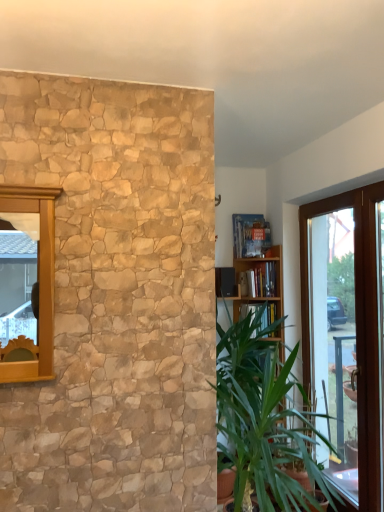
Question: Is point (261, 286) closer or farther from the camera than point (241, 218)?

Choices:
 (A) closer
 (B) farther

Answer: (A)

Question: From the image's perspective, relative to hardcover book at upper center, placed as the second book when sorted from bottom to top, is hardcover book at center, the first book from the bottom, above or below?

Choices:
 (A) above
 (B) below

Answer: (B)

Question: Which object is positioned farthest from the hardcover book at upper center, the 1th book when ordered from top to bottom?

Choices:
 (A) hardcover book at center, the first book from the bottom
 (B) transparent glass door at right
 (C) green leafy plant at right

Answer: (C)

Question: Which object is positioned farthest from the hardcover book at center, the first book from the bottom?

Choices:
 (A) transparent glass door at right
 (B) hardcover book at upper center, the 1th book when ordered from top to bottom
 (C) green leafy plant at right

Answer: (C)